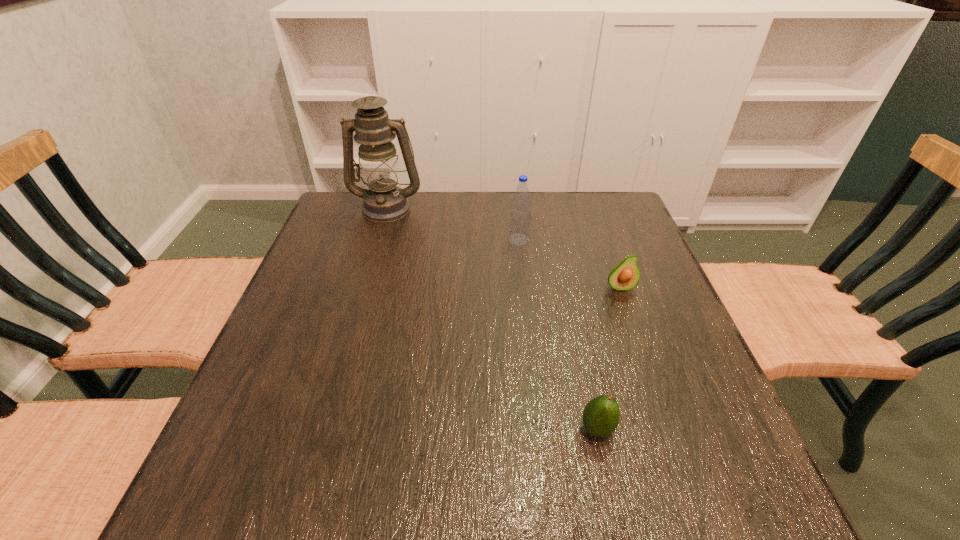
You are a GUI agent. You are given a task and a screenshot of the screen. Output one action in this format:
    pyautogui.click(x=<x>, y=<y>)
    Task: Click on the free spot located on the cut side of the rightmost object
    
    Given the screenshot: What is the action you would take?
    pyautogui.click(x=671, y=431)

Image resolution: width=960 pixels, height=540 pixels. I want to click on blank space located 0.270m on the back of the shortest object, so click(570, 308).

At what (x,y) coordinates should I click in order to perform the action: click on oil lamp that is at the far edge. Please return your answer as a coordinate pair (x, y). Looking at the image, I should click on (384, 201).

I want to click on water bottle located in the far edge section of the desktop, so click(520, 218).

Locate an element on the screen. This screenshot has width=960, height=540. object that is at the left edge is located at coordinates (384, 201).

The height and width of the screenshot is (540, 960). I want to click on object at the right edge, so click(624, 276).

At what (x,y) coordinates should I click in order to perform the action: click on object situated at the far left corner. Please return your answer as a coordinate pair (x, y). Looking at the image, I should click on (384, 201).

Find the location of a particular element. vacant point at the far edge is located at coordinates (558, 236).

This screenshot has height=540, width=960. In the image, there is a desktop. In order to click on vacant region at the near edge in this screenshot , I will do `click(458, 497)`.

You are a GUI agent. You are given a task and a screenshot of the screen. Output one action in this format:
    pyautogui.click(x=<x>, y=<y>)
    Task: Click on the vacant space at the left edge of the desktop
    
    Given the screenshot: What is the action you would take?
    pyautogui.click(x=292, y=340)